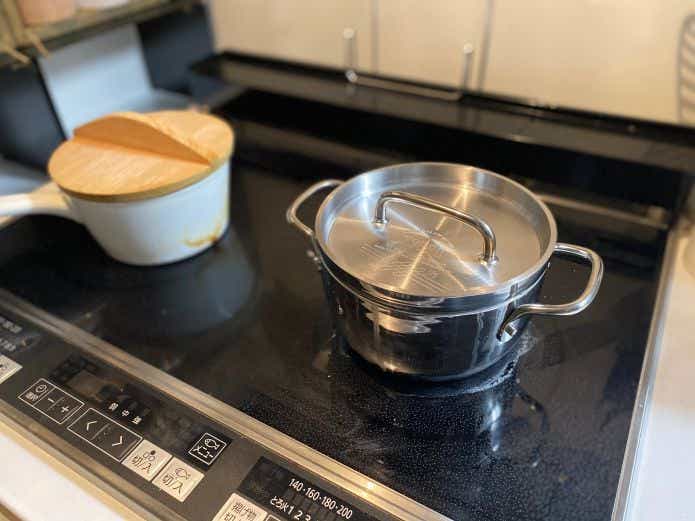
Where is `white pot`? This screenshot has width=695, height=521. white pot is located at coordinates (145, 224).